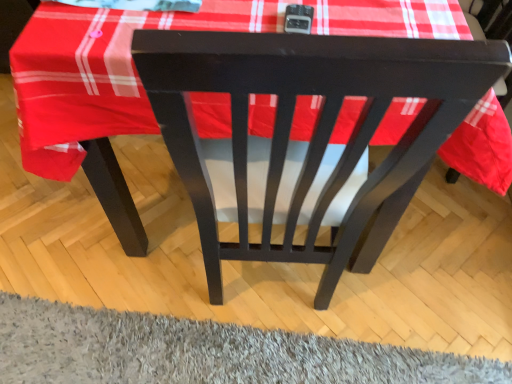
The height and width of the screenshot is (384, 512). What do you see at coordinates (203, 352) in the screenshot?
I see `gray shaggy rug at lower center` at bounding box center [203, 352].

The width and height of the screenshot is (512, 384). I want to click on gray shaggy rug at lower center, so click(203, 352).

Looking at this image, in order to face gray shaggy rug at lower center, should I rotate leftwards or rightwards?

Turn left by 0.998 degrees to look at gray shaggy rug at lower center.

Where is `matte black chair at center`? matte black chair at center is located at coordinates (315, 126).

What do you see at coordinates (315, 126) in the screenshot? Image resolution: width=512 pixels, height=384 pixels. I see `matte black chair at center` at bounding box center [315, 126].

Find the location of `gray shaggy rug at lower center`. gray shaggy rug at lower center is located at coordinates (203, 352).

Which object is positioned more to the left, matte black chair at center or gray shaggy rug at lower center?

matte black chair at center.

Is matte black chair at center further to camera compared to gray shaggy rug at lower center?

Yes, it is behind gray shaggy rug at lower center.

Considering the points (446, 127) and (205, 327), which point is behind, point (446, 127) or point (205, 327)?

The point (205, 327) is behind.

From the picture: From the image's perspective, is matte black chair at center under gray shaggy rug at lower center?

No, from the image's perspective, matte black chair at center is not below gray shaggy rug at lower center.

From a real-world perspective, is matte black chair at center positioned above or below gray shaggy rug at lower center?

In terms of real-world spatial position, matte black chair at center is below gray shaggy rug at lower center.

Looking at their sizes, would you say matte black chair at center is wider or thinner than gray shaggy rug at lower center?

In the image, matte black chair at center appears to be wider than gray shaggy rug at lower center.

Consider the image. Which of these two, matte black chair at center or gray shaggy rug at lower center, stands shorter?

gray shaggy rug at lower center is shorter.

Based on the photo, between matte black chair at center and gray shaggy rug at lower center, which one has smaller size?

gray shaggy rug at lower center is smaller.

Would you say matte black chair at center is outside gray shaggy rug at lower center?

Yes, matte black chair at center is outside of gray shaggy rug at lower center.

Are matte black chair at center and gray shaggy rug at lower center beside each other?

No.

Looking at this image, is matte black chair at center aimed at gray shaggy rug at lower center?

No, matte black chair at center is not turned towards gray shaggy rug at lower center.

How many degrees apart are the facing directions of matte black chair at center and gray shaggy rug at lower center?

The angle between the facing direction of matte black chair at center and the facing direction of gray shaggy rug at lower center is 1.73 degrees.

Measure the distance between matte black chair at center and gray shaggy rug at lower center.

matte black chair at center and gray shaggy rug at lower center are 19.88 inches apart from each other.

Locate an element on the screen. The width and height of the screenshot is (512, 384). mat above the matte black chair at center (from a real-world perspective) is located at coordinates (203, 352).

Considering the relative positions of gray shaggy rug at lower center and matte black chair at center in the image provided, is gray shaggy rug at lower center to the left or to the right of matte black chair at center?

Based on their positions, gray shaggy rug at lower center is located to the right of matte black chair at center.

Which object is further away from the camera taking this photo, gray shaggy rug at lower center or matte black chair at center?

Positioned behind is matte black chair at center.

Which is closer to the camera, (216, 342) or (176, 77)?

Point (216, 342) is farther from the camera than point (176, 77).

From the image's perspective, which is above, gray shaggy rug at lower center or matte black chair at center?

matte black chair at center is shown above in the image.

Based on the photo, from a real-world perspective, is gray shaggy rug at lower center on matte black chair at center?

Yes, from a real-world perspective, gray shaggy rug at lower center is on top of matte black chair at center.

Between gray shaggy rug at lower center and matte black chair at center, which one has larger width?

matte black chair at center is wider.

Considering the relative sizes of gray shaggy rug at lower center and matte black chair at center in the image provided, is gray shaggy rug at lower center taller than matte black chair at center?

Incorrect, the height of gray shaggy rug at lower center is not larger of that of matte black chair at center.

Who is bigger, gray shaggy rug at lower center or matte black chair at center?

With larger size is matte black chair at center.

Is gray shaggy rug at lower center located outside matte black chair at center?

No, gray shaggy rug at lower center is not outside of matte black chair at center.

Is gray shaggy rug at lower center far away from matte black chair at center?

No, gray shaggy rug at lower center is not far from matte black chair at center.

Is gray shaggy rug at lower center facing towards matte black chair at center?

Yes, gray shaggy rug at lower center is oriented towards matte black chair at center.

Can you tell me how much gray shaggy rug at lower center and matte black chair at center differ in facing direction?

The angle between the facing direction of gray shaggy rug at lower center and the facing direction of matte black chair at center is 1.73 degrees.

This screenshot has width=512, height=384. What are the coordinates of `mat above the matte black chair at center (from a real-world perspective)` in the screenshot? It's located at (203, 352).

At what (x,y) coordinates should I click in order to perform the action: click on chair on the left of gray shaggy rug at lower center. Please return your answer as a coordinate pair (x, y). The height and width of the screenshot is (384, 512). Looking at the image, I should click on (315, 126).

Where is `chair below the gray shaggy rug at lower center (from a real-world perspective)`? The width and height of the screenshot is (512, 384). chair below the gray shaggy rug at lower center (from a real-world perspective) is located at coordinates (315, 126).